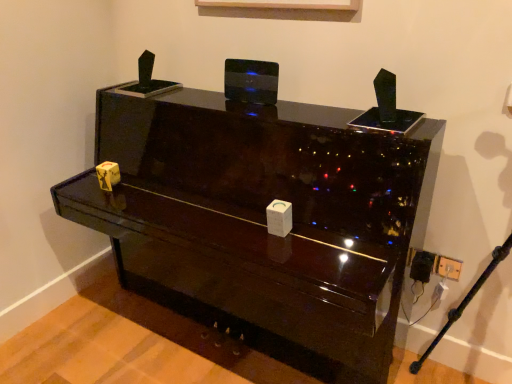
Question: Is glossy black piano at center in front of or behind white plastic electric outlet at lower right in the image?

Choices:
 (A) behind
 (B) front

Answer: (B)

Question: Would you say glossy black piano at center is inside or outside white plastic electric outlet at lower right?

Choices:
 (A) outside
 (B) inside

Answer: (A)

Question: Based on their sizes in the image, would you say glossy black piano at center is bigger or smaller than white plastic electric outlet at lower right?

Choices:
 (A) small
 (B) big

Answer: (B)

Question: From the image's perspective, is white plastic electric outlet at lower right positioned above or below glossy black piano at center?

Choices:
 (A) below
 (B) above

Answer: (A)

Question: Considering the relative positions of white plastic electric outlet at lower right and glossy black piano at center in the image provided, is white plastic electric outlet at lower right to the left or to the right of glossy black piano at center?

Choices:
 (A) left
 (B) right

Answer: (B)

Question: Considering the positions of white plastic electric outlet at lower right and glossy black piano at center in the image, is white plastic electric outlet at lower right taller or shorter than glossy black piano at center?

Choices:
 (A) short
 (B) tall

Answer: (A)

Question: From a real-world perspective, is white plastic electric outlet at lower right above or below glossy black piano at center?

Choices:
 (A) above
 (B) below

Answer: (B)